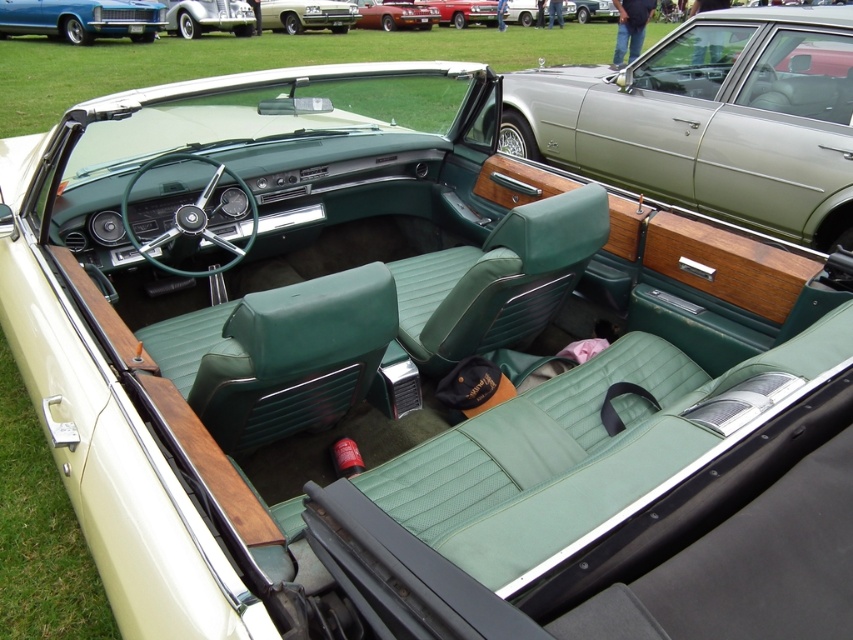
You are a photographer setting up a shoot inside the vintage convertible car. You need to position a 1.8m tall mannequin between the shiny silver car at upper left and the metallic silver sedan at center. Will the mannequin fit vertically between them?

The shiny silver car at upper left is taller than the metallic silver sedan at center. The mannequin is 1.8m tall, but the vertical space between the two cars depends on their height difference and the available clearance. Since the description only states which car is taller, not the exact heights or distance between them, it is impossible to determine if the mannequin will fit vertically between them based on the given information.

You are sitting in the vintage convertible car and want to reach both the point at coordinates point (714, 35) and the point at coordinates point (186, 1). Which point will be easier to reach without moving your seat?

The point at coordinates point (714, 35) will be easier to reach because it is closer to you than the point at coordinates point (186, 1).